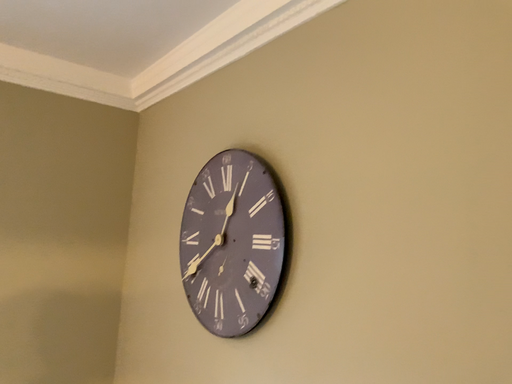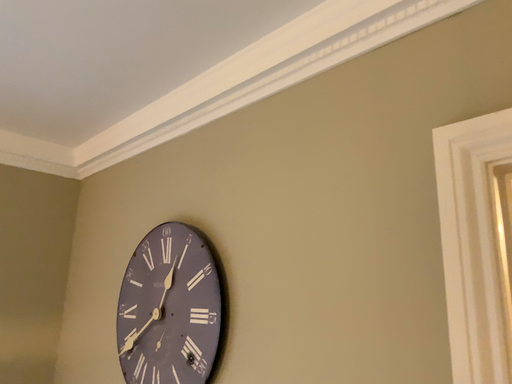
Question: Which way did the camera rotate in the video?

Choices:
 (A) rotated right
 (B) rotated left

Answer: (A)